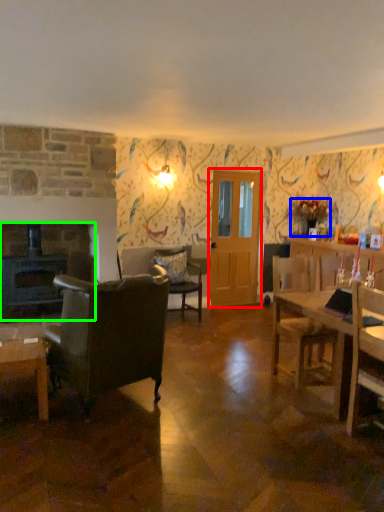
Question: Estimate the real-world distances between objects in this image. Which object is closer to glass door (highlighted by a red box), houseplant (highlighted by a blue box) or fireplace (highlighted by a green box)?

Choices:
 (A) houseplant
 (B) fireplace

Answer: (A)